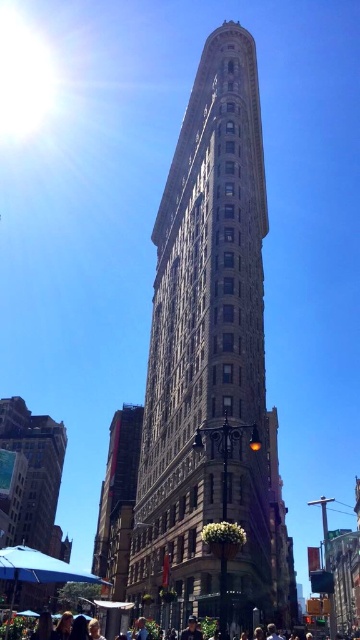
Which is above, stone textured building at center or matte black people at lower center?

stone textured building at center

What do you see at coordinates (210, 362) in the screenshot?
I see `stone textured building at center` at bounding box center [210, 362].

Which is behind, point (249, 420) or point (11, 628)?

The point (249, 420) is more distant.

Locate an element on the screen. The height and width of the screenshot is (640, 360). stone textured building at center is located at coordinates (210, 362).